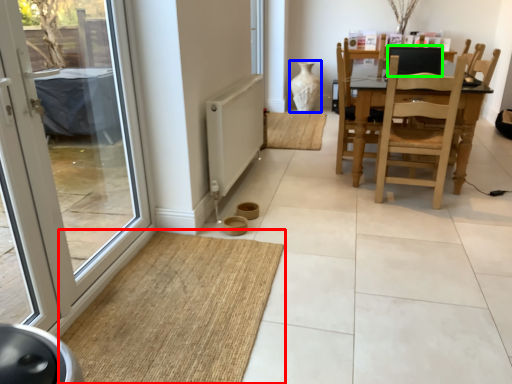
Question: Considering the real-world distances, which object is farthest from doormat (highlighted by a red box)? vase (highlighted by a blue box) or back (highlighted by a green box)?

Choices:
 (A) vase
 (B) back

Answer: (A)